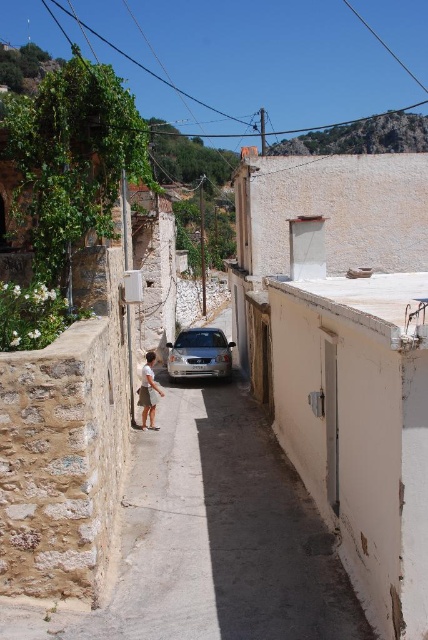
Question: Which point is farther from the camera taking this photo?

Choices:
 (A) (229, 349)
 (B) (121, 605)

Answer: (A)

Question: Is smooth concrete alley at center smaller than silver metallic car at center?

Choices:
 (A) yes
 (B) no

Answer: (B)

Question: Does smooth concrete alley at center have a lesser width compared to silver metallic car at center?

Choices:
 (A) no
 (B) yes

Answer: (A)

Question: Which point appears closest to the camera in this image?

Choices:
 (A) (157, 388)
 (B) (220, 378)

Answer: (A)

Question: Estimate the real-world distances between objects in this image. Which object is farther from the smooth concrete alley at center?

Choices:
 (A) silver metallic car at center
 (B) white cotton shirt at center

Answer: (A)

Question: Is smooth concrete alley at center thinner than white cotton shirt at center?

Choices:
 (A) no
 (B) yes

Answer: (A)